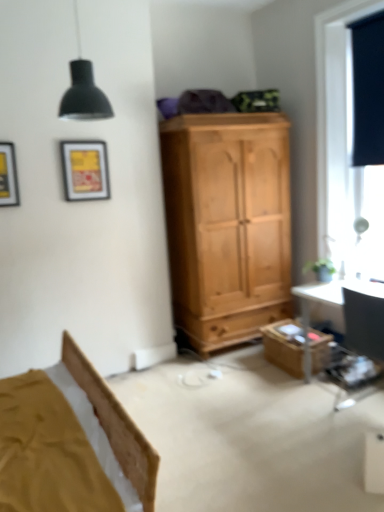
Question: In the image, is black matte lampshade at upper left on the left side or the right side of wooden box at lower right?

Choices:
 (A) right
 (B) left

Answer: (B)

Question: Considering the positions of point (71, 117) and point (276, 337), is point (71, 117) closer or farther from the camera than point (276, 337)?

Choices:
 (A) closer
 (B) farther

Answer: (A)

Question: Which is nearer to the black matte curtain at upper right?

Choices:
 (A) black fabric window at right
 (B) matte yellow picture frame at upper left, arranged as the second picture frame when viewed from the right
 (C) matte yellow picture frame at upper left, placed as the 1th picture frame when sorted from right to left
 (D) black matte lampshade at upper left
 (E) wooden box at lower right

Answer: (A)

Question: Considering the real-world distances, which object is farthest from the matte yellow picture frame at upper left, marked as the second picture frame in a front-to-back arrangement?

Choices:
 (A) black fabric window at right
 (B) matte yellow picture frame at upper left, which ranks as the second picture frame in back-to-front order
 (C) black matte lampshade at upper left
 (D) black matte curtain at upper right
 (E) wooden box at lower right

Answer: (D)